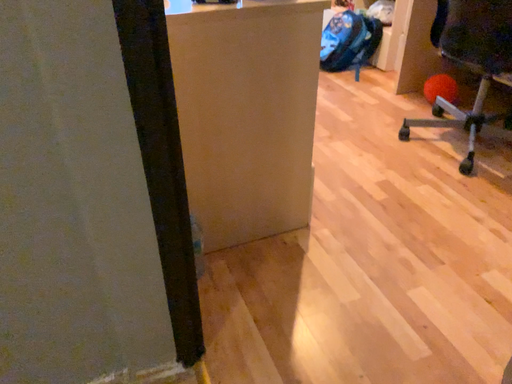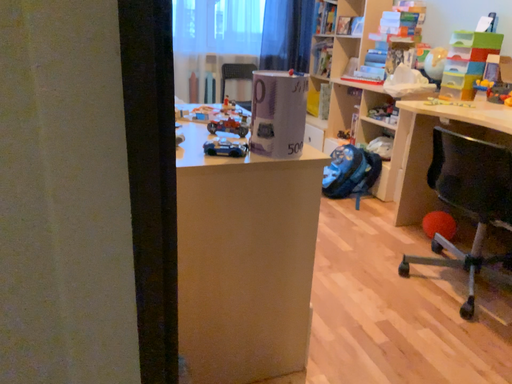
Question: How did the camera likely rotate when shooting the video?

Choices:
 (A) rotated downward
 (B) rotated upward

Answer: (B)